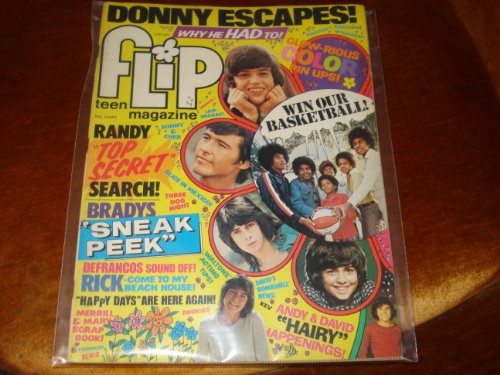
Identify the location of magazine. The image size is (500, 375). (354, 335).